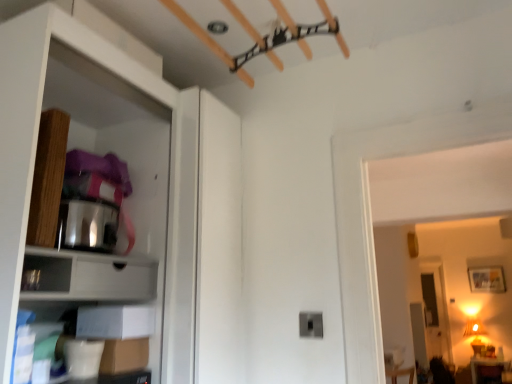
Question: In terms of width, does matte white cabinet at left look wider or thinner when compared to white matte cabinet at lower left?

Choices:
 (A) wide
 (B) thin

Answer: (A)

Question: In the image, is matte white cabinet at left on the left side or the right side of white matte cabinet at lower left?

Choices:
 (A) left
 (B) right

Answer: (B)

Question: Based on their relative distances, which object is farther from the matte white cabinet at left?

Choices:
 (A) matte brown cushion at lower right
 (B) matte black drawer at lower left
 (C) white matte cabinet at lower left

Answer: (A)

Question: Which of these objects is positioned closest to the matte white cabinet at left?

Choices:
 (A) matte black drawer at lower left
 (B) matte brown cushion at lower right
 (C) white matte cabinet at lower left

Answer: (C)